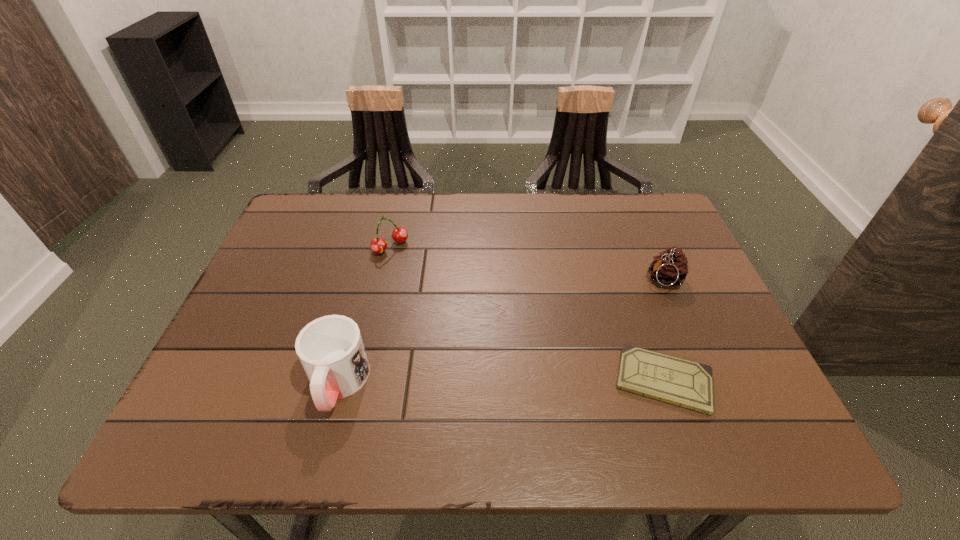
The image size is (960, 540). I want to click on vacant spot on the desktop that is between the mug and the checkbook and is positioned with a leaf charm attached to the second farthest object, so click(x=471, y=382).

Image resolution: width=960 pixels, height=540 pixels. I want to click on vacant spot on the desktop that is between the mug and the checkbook and is positioned with stems pointing upwards on the farthest object, so click(534, 382).